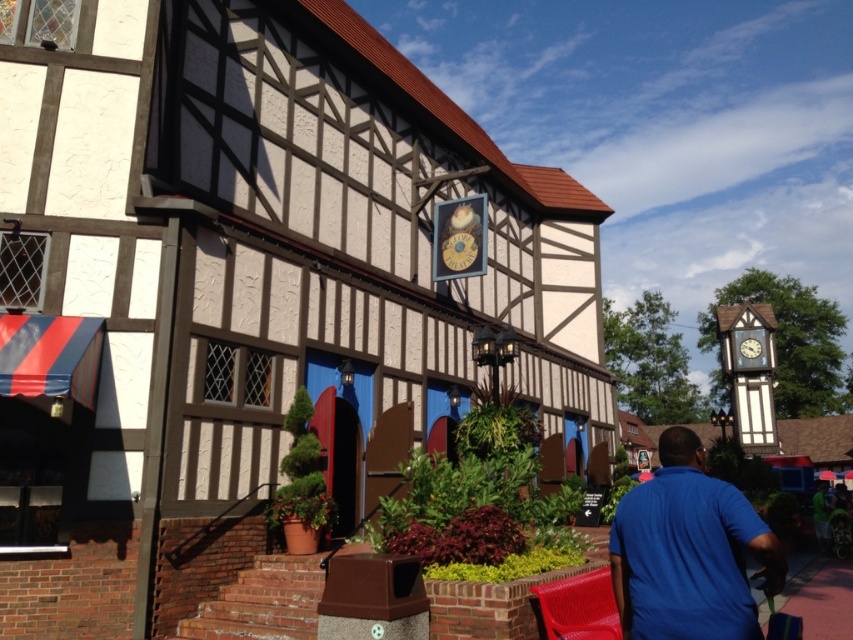
Is blue matte shirt at center bigger than wooden clock at center?

Yes, blue matte shirt at center is bigger than wooden clock at center.

Is point (679, 545) closer to viewer compared to point (744, 355)?

That is True.

Locate an element on the screen. This screenshot has width=853, height=640. blue matte shirt at center is located at coordinates (688, 552).